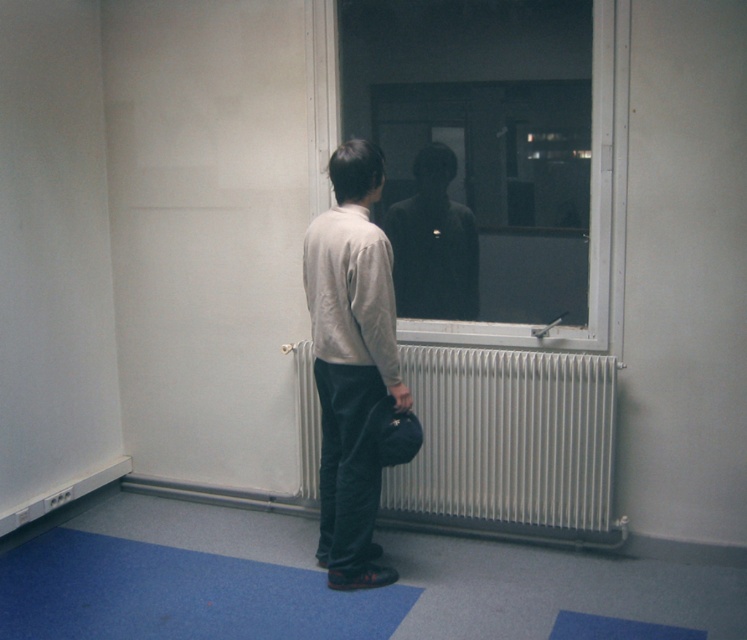
Between light beige sweater at center and dark matte figure at center, which one appears on the left side from the viewer's perspective?

light beige sweater at center

Is light beige sweater at center taller than dark matte figure at center?

Correct, light beige sweater at center is much taller as dark matte figure at center.

Is point (334, 312) in front of point (465, 211)?

Yes, point (334, 312) is closer to viewer.

Identify the location of light beige sweater at center. This screenshot has width=747, height=640. (350, 362).

This screenshot has height=640, width=747. Describe the element at coordinates (350, 362) in the screenshot. I see `light beige sweater at center` at that location.

Who is lower down, light beige sweater at center or transparent glass window at center?

light beige sweater at center

Which is in front, point (359, 294) or point (314, 138)?

Point (359, 294) is in front.

This screenshot has height=640, width=747. I want to click on light beige sweater at center, so click(350, 362).

Based on the photo, does white metallic radiator at center appear over blue carpet at lower left?

Correct, white metallic radiator at center is located above blue carpet at lower left.

Between white metallic radiator at center and blue carpet at lower left, which one appears on the left side from the viewer's perspective?

From the viewer's perspective, blue carpet at lower left appears more on the left side.

Between point (607, 474) and point (359, 592), which one is positioned behind?

Positioned behind is point (607, 474).

The width and height of the screenshot is (747, 640). What are the coordinates of `white metallic radiator at center` in the screenshot? It's located at (509, 445).